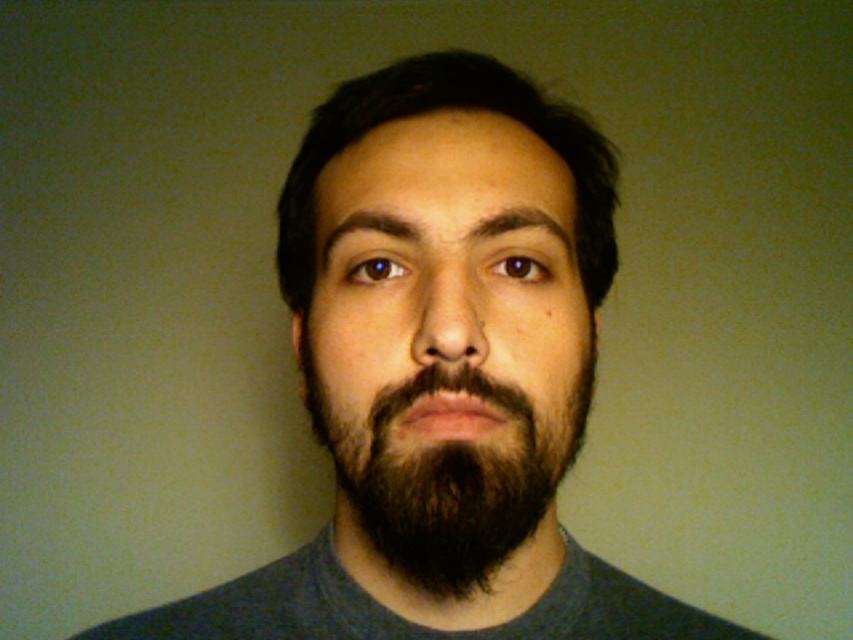
Which is below, dark brown fuzzy beard at center or dark brown hair at center?

dark brown fuzzy beard at center is below.

Measure the distance between dark brown fuzzy beard at center and camera.

dark brown fuzzy beard at center and camera are 12.70 inches apart from each other.

Does point (425, 556) come farther from viewer compared to point (610, 168)?

No, it is not.

Locate an element on the screen. Image resolution: width=853 pixels, height=640 pixels. dark brown fuzzy beard at center is located at coordinates (445, 476).